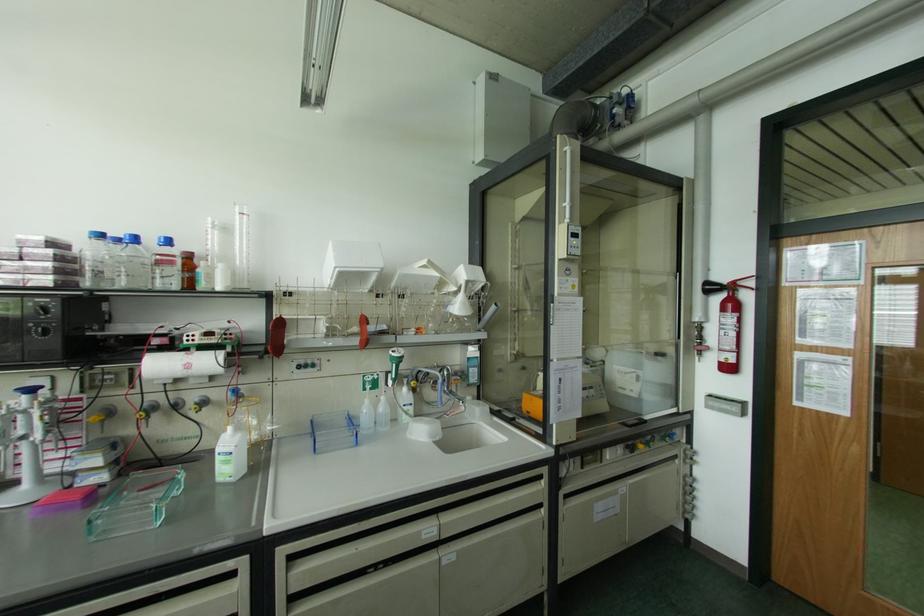
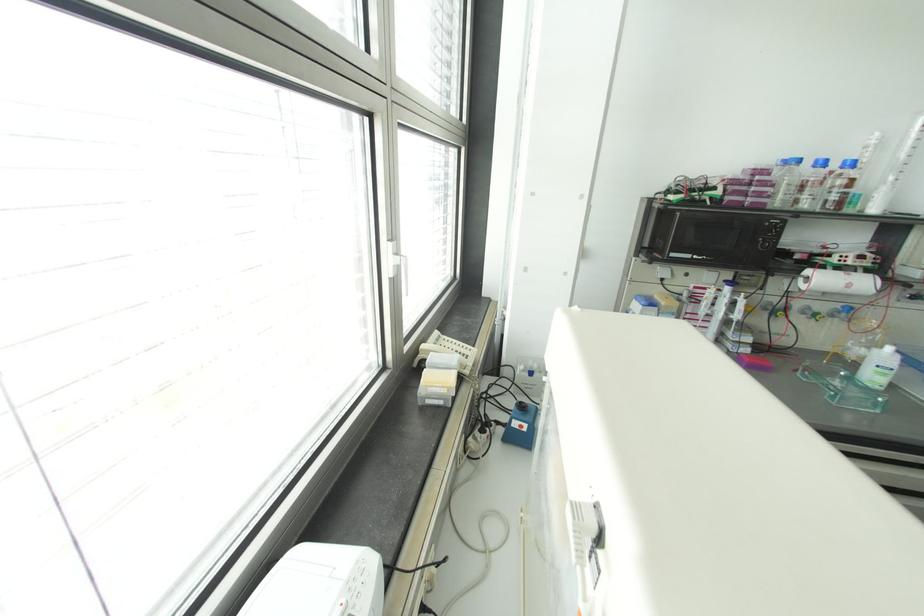
Locate, in the second image, the point that corresponds to [134,238] in the first image.

(822, 163)